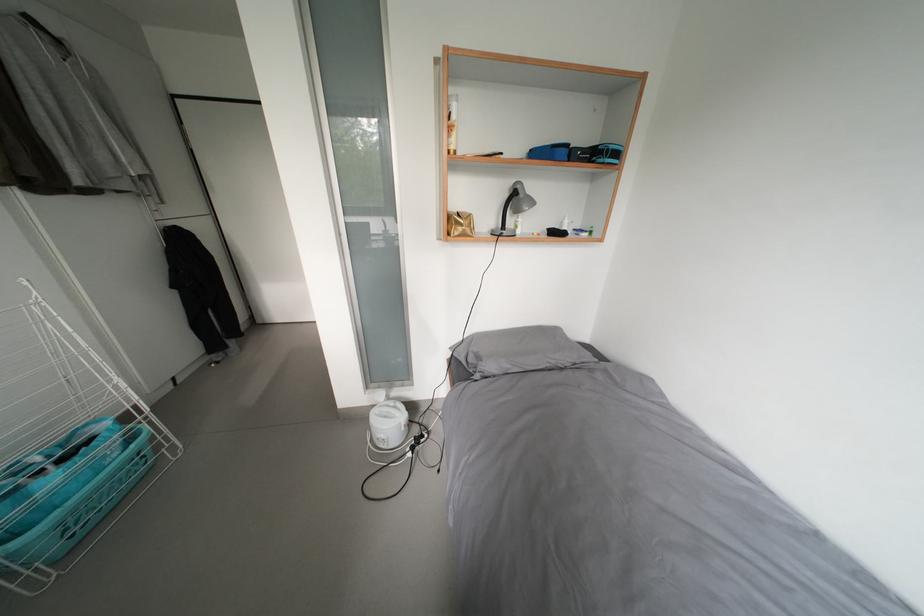
Find where to lift the blue laundry basket. Please return your answer as a coordinate pair (x, y).

(73, 493)